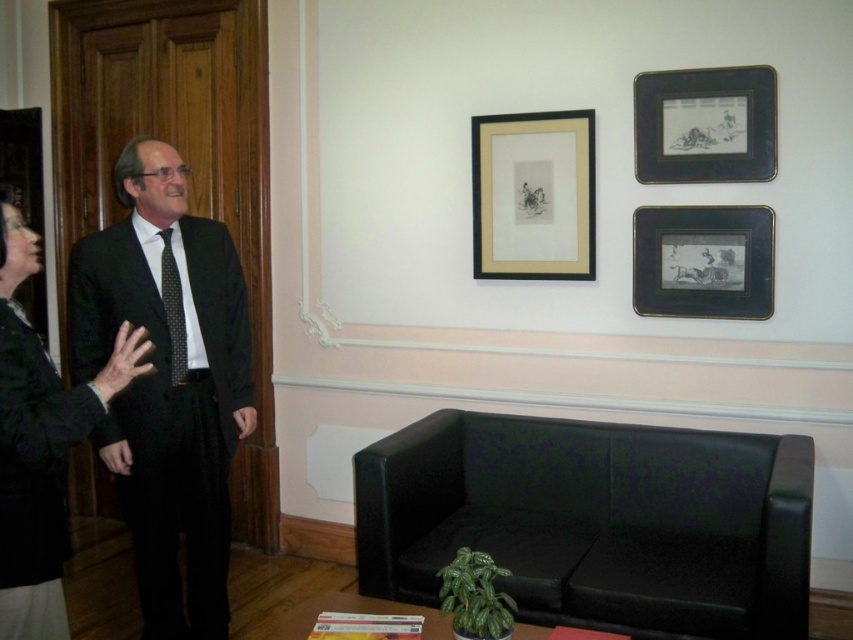
Does black textured jacket at left come behind black matte picture frame at upper right?

No, it is not.

The image size is (853, 640). I want to click on black textured jacket at left, so click(41, 442).

Where is `black textured jacket at left`? This screenshot has height=640, width=853. black textured jacket at left is located at coordinates (41, 442).

Is black leather couch at lower right thinner than gold matte picture frame at center?

No, black leather couch at lower right is not thinner than gold matte picture frame at center.

Where is `black leather couch at lower right`? Image resolution: width=853 pixels, height=640 pixels. black leather couch at lower right is located at coordinates (595, 522).

Locate an element on the screen. black leather couch at lower right is located at coordinates (595, 522).

Is point (764, 67) positioned after point (635, 284)?

No, (764, 67) is in front of (635, 284).

What do you see at coordinates (705, 125) in the screenshot?
I see `black matte picture frame at upper right` at bounding box center [705, 125].

Locate an element on the screen. Image resolution: width=853 pixels, height=640 pixels. black matte picture frame at upper right is located at coordinates (705, 125).